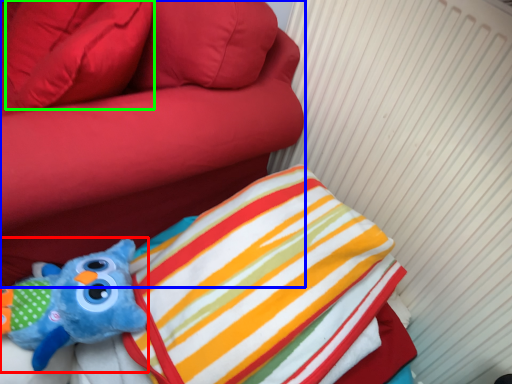
Question: Based on their relative distances, which object is farther from toy (highlighted by a red box)? Choose from furniture (highlighted by a blue box) and pillow (highlighted by a green box).

Choices:
 (A) furniture
 (B) pillow

Answer: (B)